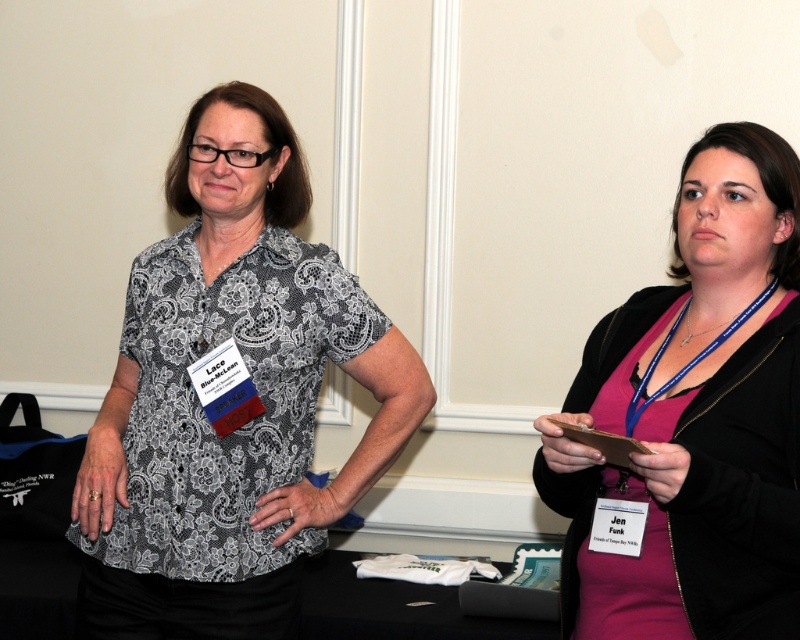
You are an event organizer and need to arrange seating for two speakers. The first speaker is wearing a lace fabric blouse at center and the second speaker is wearing a pink fabric dress at right. Based on their positions in the image, which speaker should you seat closer to the podium?

The lace fabric blouse at center is above the pink fabric dress at right in the image, so the lace fabric blouse at center should be seated closer to the podium since they are positioned higher in the frame.